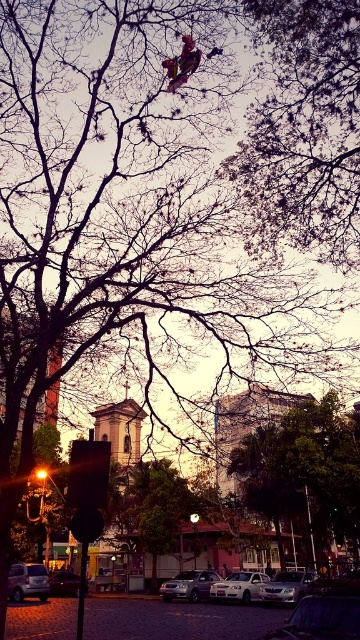
Does silver metallic suv at center come behind silver metallic car at center?

Yes, it is.

You are a GUI agent. You are given a task and a screenshot of the screen. Output one action in this format:
    pyautogui.click(x=<x>, y=<y>)
    Task: Click on the silver metallic suv at center
    The height and width of the screenshot is (640, 360).
    Given the screenshot: What is the action you would take?
    pyautogui.click(x=189, y=584)

Does silver metallic car at center have a lesser width compared to metallic silver car at lower left?

Incorrect, silver metallic car at center's width is not less than metallic silver car at lower left's.

Can you confirm if silver metallic car at center is shorter than metallic silver car at lower left?

No, silver metallic car at center is not shorter than metallic silver car at lower left.

Which is in front, point (221, 580) or point (68, 577)?

Point (221, 580)

Locate an element on the screen. The width and height of the screenshot is (360, 640). silver metallic car at center is located at coordinates (239, 586).

Between brown textured tree at upper center and metallic red skateboard at upper center, which one appears on the right side from the viewer's perspective?

From the viewer's perspective, brown textured tree at upper center appears more on the right side.

The width and height of the screenshot is (360, 640). Describe the element at coordinates (304, 131) in the screenshot. I see `brown textured tree at upper center` at that location.

Image resolution: width=360 pixels, height=640 pixels. I want to click on brown textured tree at upper center, so click(304, 131).